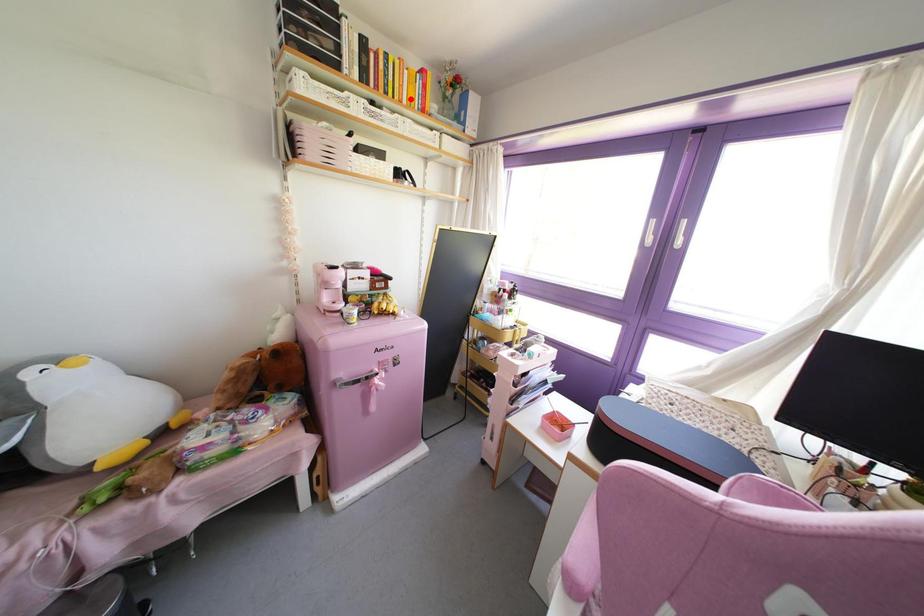
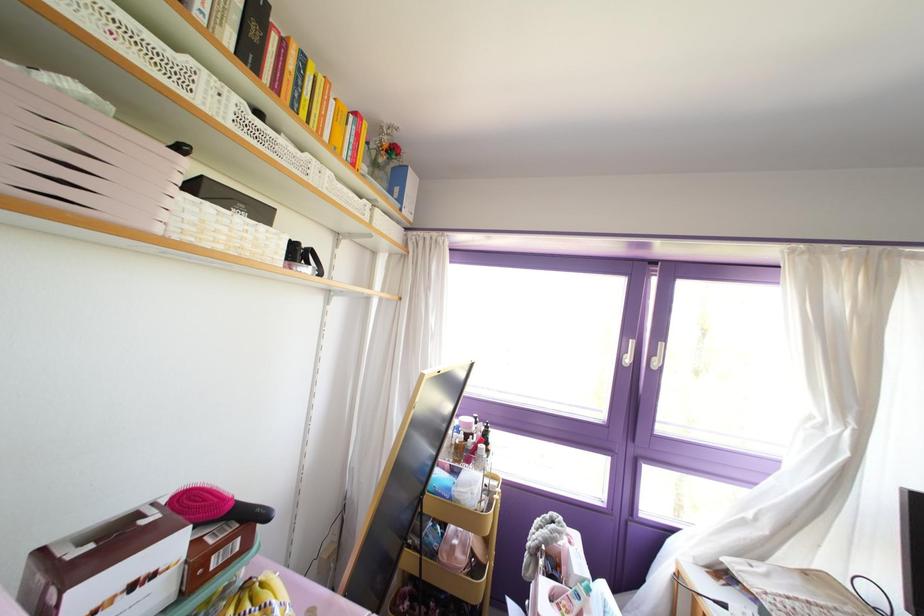
In the second image, find the point that corresponds to the highlighted location in the first image.

(335, 143)